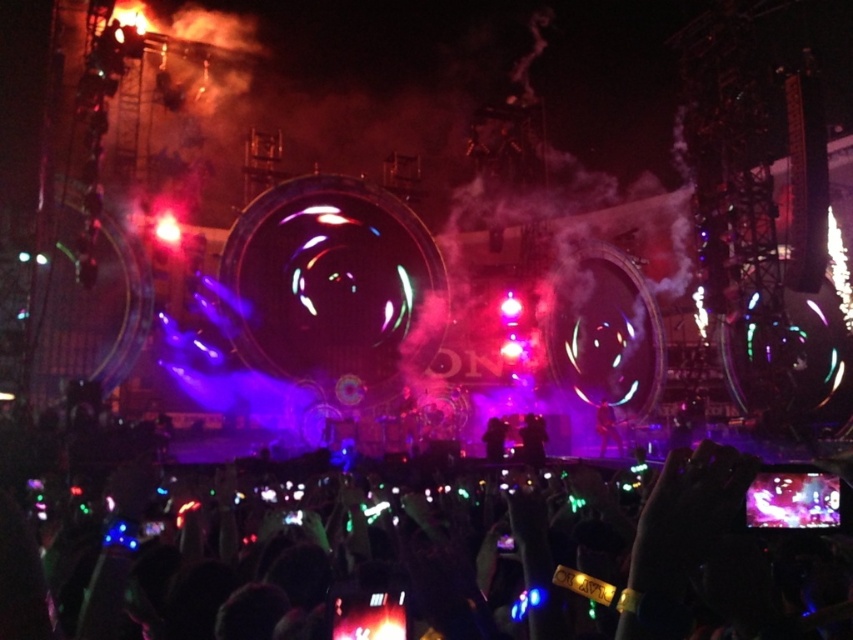
You are a photographer at the concert. You want to capture a photo of the black velvet suit at center while avoiding the silvery reflective phone at center in the frame. Which direction should you move your camera to ensure the phone is out of the shot?

Move your camera to the right so that the silvery reflective phone at center is no longer in the frame. Since the silvery reflective phone at center is to the left of the black velvet suit at center, moving the camera to the right will shift the phone out of the shot while keeping the suit in view.

You are a photographer at the concert. You want to capture a photo of the silvery reflective phone at center located at point (431,556). Which direction should you move your camera to focus on it?

The silvery reflective phone at center is located at point (431,556), so you should move your camera towards the center of the image to focus on it.